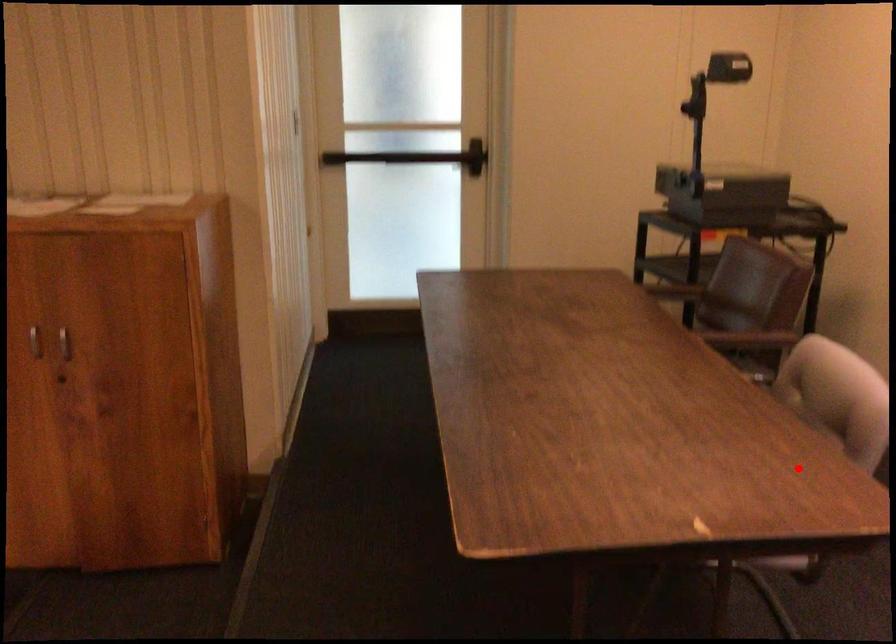
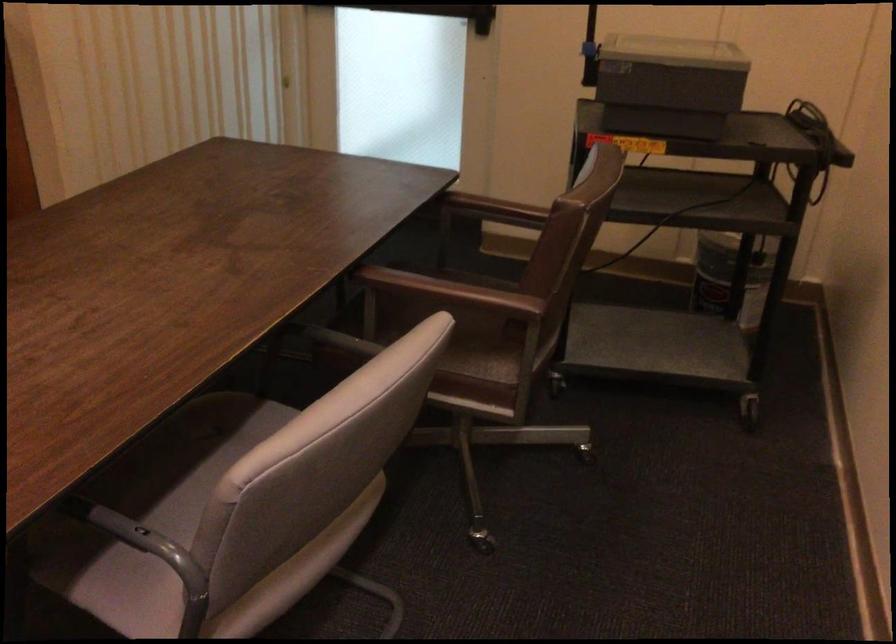
Locate, in the second image, the point that corresponds to the highlighted location in the first image.

(140, 538)